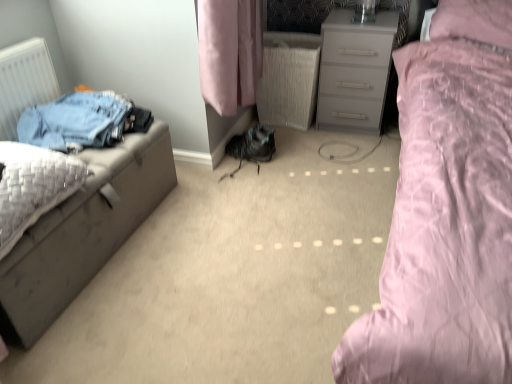
Question: Is white matte radiator at left wider than pink satin bed at right?

Choices:
 (A) no
 (B) yes

Answer: (A)

Question: Is white matte radiator at left outside of pink satin bed at right?

Choices:
 (A) no
 (B) yes

Answer: (B)

Question: Considering the relative sizes of white matte radiator at left and pink satin bed at right in the image provided, is white matte radiator at left shorter than pink satin bed at right?

Choices:
 (A) no
 (B) yes

Answer: (B)

Question: Does white matte radiator at left have a greater height compared to pink satin bed at right?

Choices:
 (A) yes
 (B) no

Answer: (B)

Question: Does white matte radiator at left come behind pink satin bed at right?

Choices:
 (A) no
 (B) yes

Answer: (B)

Question: Is white matte radiator at left positioned before pink satin bed at right?

Choices:
 (A) no
 (B) yes

Answer: (A)

Question: Does matte gray nightstand at left have a lesser height compared to pink satin bed at right?

Choices:
 (A) no
 (B) yes

Answer: (B)

Question: Are matte gray nightstand at left and pink satin bed at right far apart?

Choices:
 (A) yes
 (B) no

Answer: (A)

Question: Can you confirm if matte gray nightstand at left is smaller than pink satin bed at right?

Choices:
 (A) no
 (B) yes

Answer: (B)

Question: From the image's perspective, does matte gray nightstand at left appear lower than pink satin bed at right?

Choices:
 (A) no
 (B) yes

Answer: (B)

Question: Is pink satin bed at right at the back of matte gray nightstand at left?

Choices:
 (A) yes
 (B) no

Answer: (B)

Question: Does matte gray nightstand at left have a larger size compared to pink satin bed at right?

Choices:
 (A) no
 (B) yes

Answer: (A)

Question: Considering the relative sizes of matte gray chest of drawers at center and white matte radiator at left in the image provided, is matte gray chest of drawers at center thinner than white matte radiator at left?

Choices:
 (A) no
 (B) yes

Answer: (A)